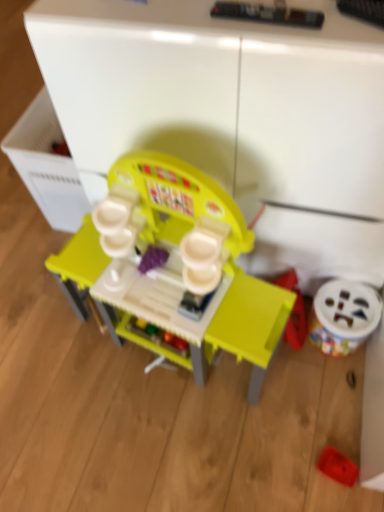
Find the location of a particular element. The height and width of the screenshot is (512, 384). free space to the left of white plastic drawer at left is located at coordinates tap(20, 222).